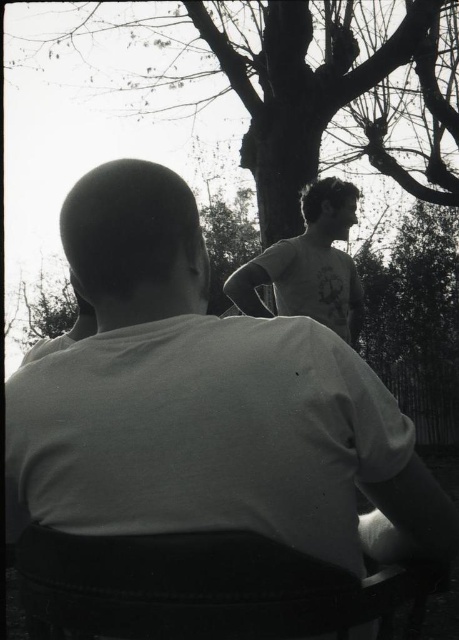
Question: Can you confirm if bare branches at upper center is positioned below white cotton t-shirt at upper right?

Choices:
 (A) no
 (B) yes

Answer: (A)

Question: Which is farther from the black fabric chair at lower center?

Choices:
 (A) bare branches at upper center
 (B) white cotton shirt at center

Answer: (A)

Question: Which is farther from the black fabric chair at lower center?

Choices:
 (A) white cotton shirt at center
 (B) white cotton t-shirt at upper right

Answer: (B)

Question: Which object is farther from the camera taking this photo?

Choices:
 (A) white cotton shirt at center
 (B) bare branches at upper center
 (C) black fabric chair at lower center
 (D) white cotton t-shirt at upper right

Answer: (B)

Question: Does white cotton shirt at center appear on the left side of white cotton t-shirt at upper right?

Choices:
 (A) yes
 (B) no

Answer: (A)

Question: Can you confirm if white cotton shirt at center is bigger than black fabric chair at lower center?

Choices:
 (A) yes
 (B) no

Answer: (A)